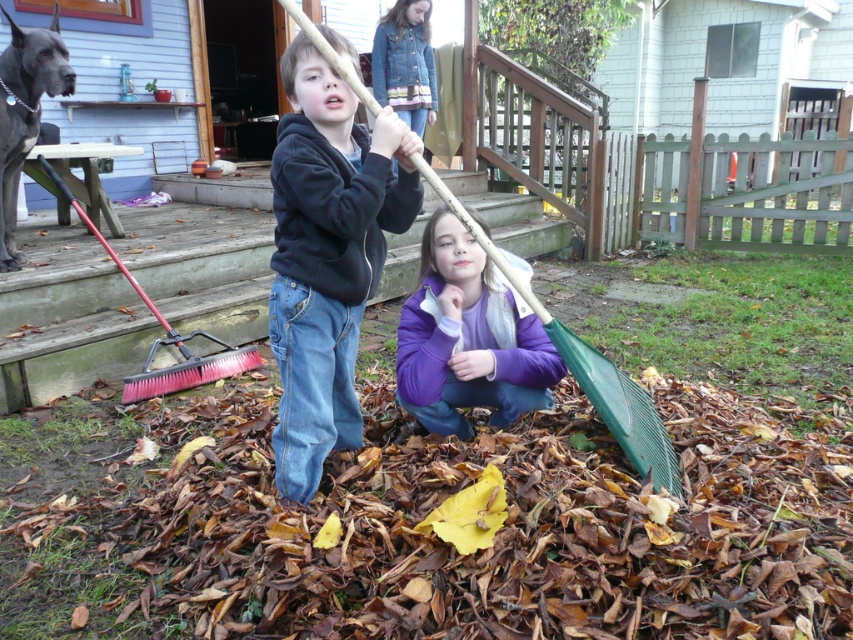
Who is taller, purple fleece jacket at lower center or denim jacket at upper center?

With more height is denim jacket at upper center.

Is purple fleece jacket at lower center taller than denim jacket at upper center?

Incorrect, purple fleece jacket at lower center's height is not larger of denim jacket at upper center's.

Describe the element at coordinates (468, 339) in the screenshot. I see `purple fleece jacket at lower center` at that location.

The image size is (853, 640). I want to click on purple fleece jacket at lower center, so click(x=468, y=339).

Which is in front, point (521, 216) or point (0, 102)?

Point (0, 102) is in front.

Is wooden porch at lower left to the left of gray fur dog at left from the viewer's perspective?

In fact, wooden porch at lower left is to the right of gray fur dog at left.

Which is in front, point (393, 237) or point (28, 124)?

Positioned in front is point (28, 124).

What are the coordinates of `wooden porch at lower left` in the screenshot? It's located at (67, 317).

In the scene shown: Who is positioned more to the left, dark blue hoodie at center or gray fur dog at left?

gray fur dog at left

Who is lower down, dark blue hoodie at center or gray fur dog at left?

dark blue hoodie at center

At what (x,y) coordinates should I click in order to perform the action: click on dark blue hoodie at center. Please return your answer as a coordinate pair (x, y). Looking at the image, I should click on (328, 256).